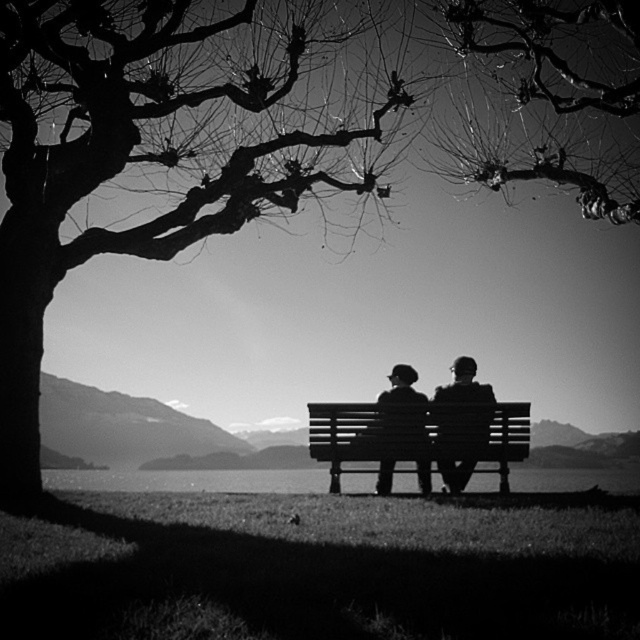
You are standing in the scene and want to place a small flag at each of the two points labeled point (161, 490) and point (468, 368). Which point will require you to walk further away from your current position to reach?

Point (468, 368) will require you to walk further away from your current position because it is farther from the viewer compared to point (161, 490), which is closer.

In the black and white photo, there are two people sitting on a bench. You notice a transparent water at bench center and a smooth black jacket at center. Which object is positioned to the left of the other?

The transparent water at bench center is to the left of the smooth black jacket at center.

In the scene shown: You are a photographer wanting to capture the wooden bench at center and the smooth black jacket at center in a new photo. Based on the scene, which object should you focus on first if you want to ensure both are in sharp focus?

The wooden bench at center is located below the smooth black jacket at center. Since the bench is lower, focusing on the bench first would allow the jacket to be within the depth of field when adjusting the focus for both objects.